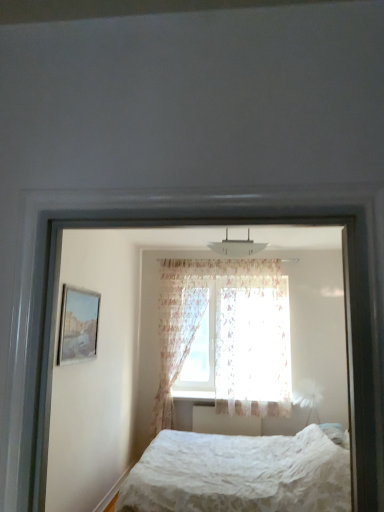
The height and width of the screenshot is (512, 384). What do you see at coordinates (253, 346) in the screenshot? I see `translucent floral fabric at center, positioned as the first curtain in right-to-left order` at bounding box center [253, 346].

The image size is (384, 512). Find the location of `translucent floral fabric at center, positioned as the first curtain in right-to-left order`. translucent floral fabric at center, positioned as the first curtain in right-to-left order is located at coordinates (253, 346).

The image size is (384, 512). Describe the element at coordinates (223, 423) in the screenshot. I see `white plastic radiator at center` at that location.

Measure the distance between floral fabric curtain at center, arranged as the 2th curtain when viewed from the right, and camera.

The depth of floral fabric curtain at center, arranged as the 2th curtain when viewed from the right, is 17.22 feet.

Identify the location of matte glass picture frame at left. (78, 325).

I want to click on white textured bed at center, acting as the second bed starting from the bottom, so click(x=239, y=474).

Which is less distant, (292, 436) or (165, 418)?

Point (292, 436).

From the image's perspective, is white lace bed at lower center, the second bed from the front, above or below floral fabric curtain at center, arranged as the 2th curtain when viewed from the right?

Based on their image positions, white lace bed at lower center, the second bed from the front, is located beneath floral fabric curtain at center, arranged as the 2th curtain when viewed from the right.

Would you say white lace bed at lower center, the second bed from the front, is a long distance from floral fabric curtain at center, arranged as the 2th curtain when viewed from the right?

Yes, white lace bed at lower center, the second bed from the front, and floral fabric curtain at center, arranged as the 2th curtain when viewed from the right, are located far from each other.

Is white lace bed at lower center, which appears as the 1th bed when viewed from the back, positioned with its back to floral fabric curtain at center, arranged as the 2th curtain when viewed from the right?

No, floral fabric curtain at center, arranged as the 2th curtain when viewed from the right, is not at the back of white lace bed at lower center, which appears as the 1th bed when viewed from the back.

In the scene shown: From the image's perspective, is floral fabric curtain at center, the first curtain when ordered from left to right, on white textured bed at center, which is the 1th bed from top to bottom?

Actually, floral fabric curtain at center, the first curtain when ordered from left to right, appears below white textured bed at center, which is the 1th bed from top to bottom, in the image.

Can you confirm if floral fabric curtain at center, the first curtain when ordered from left to right, is thinner than white textured bed at center, marked as the 2th bed in a back-to-front arrangement?

No, floral fabric curtain at center, the first curtain when ordered from left to right, is not thinner than white textured bed at center, marked as the 2th bed in a back-to-front arrangement.

Is there a large distance between floral fabric curtain at center, arranged as the 2th curtain when viewed from the right, and white textured bed at center, marked as the 2th bed in a back-to-front arrangement?

Yes, floral fabric curtain at center, arranged as the 2th curtain when viewed from the right, and white textured bed at center, marked as the 2th bed in a back-to-front arrangement, are located far from each other.

Is floral fabric curtain at center, arranged as the 2th curtain when viewed from the right, bigger than white textured bed at center, which is the 1th bed from top to bottom?

Yes, floral fabric curtain at center, arranged as the 2th curtain when viewed from the right, is bigger than white textured bed at center, which is the 1th bed from top to bottom.

Where is `bed that is the 2nd object located in front of the translucent floral fabric at center, the second curtain when ordered from left to right`? bed that is the 2nd object located in front of the translucent floral fabric at center, the second curtain when ordered from left to right is located at coordinates (239, 474).

Is translucent floral fabric at center, the second curtain when ordered from left to right, not within white textured bed at center, which is the 1th bed from top to bottom?

That's correct, translucent floral fabric at center, the second curtain when ordered from left to right, is outside of white textured bed at center, which is the 1th bed from top to bottom.

From the image's perspective, would you say translucent floral fabric at center, the second curtain when ordered from left to right, is positioned over white textured bed at center, which is the 1th bed from front to back?

No.

Is white textured bed at center, which is the 1th bed from front to back, at the back of translucent floral fabric at center, positioned as the first curtain in right-to-left order?

translucent floral fabric at center, positioned as the first curtain in right-to-left order, does not have its back to white textured bed at center, which is the 1th bed from front to back.

From a real-world perspective, which object rests below the other?

white lace bed at lower center, which appears as the 1th bed when viewed from the back, from a real-world perspective.

In the scene shown: Is white textured bed at center, which is the 1th bed from front to back, at the back of white lace bed at lower center, which is counted as the 1th bed, starting from the bottom?

That's not correct — white lace bed at lower center, which is counted as the 1th bed, starting from the bottom, is not looking away from white textured bed at center, which is the 1th bed from front to back.

Considering the positions of points (247, 503) and (345, 419), is point (247, 503) farther from camera compared to point (345, 419)?

No, it is not.

Is white lace bed at lower center, which is counted as the 1th bed, starting from the bottom, bigger than white textured bed at center, which is the 1th bed from front to back?

Yes.

Is matte glass picture frame at left oriented away from translucent floral fabric at center, positioned as the first curtain in right-to-left order?

No, matte glass picture frame at left's orientation is not away from translucent floral fabric at center, positioned as the first curtain in right-to-left order.

Considering the sizes of objects matte glass picture frame at left and translucent floral fabric at center, positioned as the first curtain in right-to-left order, in the image provided, who is taller, matte glass picture frame at left or translucent floral fabric at center, positioned as the first curtain in right-to-left order,?

translucent floral fabric at center, positioned as the first curtain in right-to-left order, is taller.

Is matte glass picture frame at left inside the boundaries of translucent floral fabric at center, positioned as the first curtain in right-to-left order, or outside?

matte glass picture frame at left cannot be found inside translucent floral fabric at center, positioned as the first curtain in right-to-left order.

Looking at their sizes, would you say matte glass picture frame at left is wider or thinner than translucent floral fabric at center, the second curtain when ordered from left to right?

Clearly, matte glass picture frame at left has less width compared to translucent floral fabric at center, the second curtain when ordered from left to right.

From a real-world perspective, which is physically above, matte glass picture frame at left or white plastic radiator at center?

In real-world perspective, matte glass picture frame at left is above.

In the scene shown: From the image's perspective, is matte glass picture frame at left above or below white plastic radiator at center?

Based on their image positions, matte glass picture frame at left is located above white plastic radiator at center.

From the picture: Does matte glass picture frame at left touch white plastic radiator at center?

No, matte glass picture frame at left is not touching white plastic radiator at center.

From the picture: Considering the sizes of matte glass picture frame at left and white plastic radiator at center in the image, is matte glass picture frame at left taller or shorter than white plastic radiator at center?

In the image, matte glass picture frame at left appears to be taller than white plastic radiator at center.

What are the coordinates of `picture frame behind the white lace bed at lower center, which appears as the 1th bed when viewed from the back` in the screenshot? It's located at (78, 325).

From the image's perspective, between white lace bed at lower center, the second bed in the top-to-bottom sequence, and matte glass picture frame at left, which one is located above?

matte glass picture frame at left.

Is the depth of white lace bed at lower center, the second bed from the front, greater than that of matte glass picture frame at left?

No, it is not.

Identify the location of curtain on the left of the white lace bed at lower center, which appears as the 1th bed when viewed from the back. (178, 326).

The width and height of the screenshot is (384, 512). What are the coordinates of `bed located above the floral fabric curtain at center, the first curtain when ordered from left to right (from the image's perspective)` in the screenshot? It's located at (239, 474).

When comparing their distances from translucent floral fabric at center, the second curtain when ordered from left to right, does matte glass picture frame at left or floral fabric curtain at center, the first curtain when ordered from left to right, seem further?

matte glass picture frame at left.

Estimate the real-world distances between objects in this image. Which object is further from white plastic radiator at center, translucent floral fabric at center, positioned as the first curtain in right-to-left order, or matte glass picture frame at left?

matte glass picture frame at left lies further to white plastic radiator at center than the other object.

Estimate the real-world distances between objects in this image. Which object is further from floral fabric curtain at center, the first curtain when ordered from left to right, white plastic radiator at center or white textured bed at center, which is the 1th bed from front to back?

white textured bed at center, which is the 1th bed from front to back, lies further to floral fabric curtain at center, the first curtain when ordered from left to right, than the other object.

Looking at this image, considering their positions, is matte glass picture frame at left positioned closer to white lace bed at lower center, which appears as the 1th bed when viewed from the back, than white textured bed at center, marked as the 2th bed in a back-to-front arrangement?

white textured bed at center, marked as the 2th bed in a back-to-front arrangement, is positioned closer to the anchor white lace bed at lower center, which appears as the 1th bed when viewed from the back.

Estimate the real-world distances between objects in this image. Which object is further from white textured bed at center, acting as the second bed starting from the bottom, white lace bed at lower center, the second bed from the front, or matte glass picture frame at left?

Among the two, matte glass picture frame at left is located further to white textured bed at center, acting as the second bed starting from the bottom.

From the image, which object appears to be nearer to matte glass picture frame at left, white lace bed at lower center, the second bed in the top-to-bottom sequence, or translucent floral fabric at center, the second curtain when ordered from left to right?

white lace bed at lower center, the second bed in the top-to-bottom sequence, lies closer to matte glass picture frame at left than the other object.

Based on their spatial positions, is white textured bed at center, acting as the second bed starting from the bottom, or white plastic radiator at center closer to translucent floral fabric at center, the second curtain when ordered from left to right?

white textured bed at center, acting as the second bed starting from the bottom, is closer to translucent floral fabric at center, the second curtain when ordered from left to right.

Considering their positions, is white plastic radiator at center positioned further to translucent floral fabric at center, positioned as the first curtain in right-to-left order, than floral fabric curtain at center, arranged as the 2th curtain when viewed from the right?

Among the two, white plastic radiator at center is located further to translucent floral fabric at center, positioned as the first curtain in right-to-left order.

Where is `picture frame positioned between white textured bed at center, acting as the second bed starting from the bottom, and translucent floral fabric at center, the second curtain when ordered from left to right, from near to far`? Image resolution: width=384 pixels, height=512 pixels. picture frame positioned between white textured bed at center, acting as the second bed starting from the bottom, and translucent floral fabric at center, the second curtain when ordered from left to right, from near to far is located at coordinates (78, 325).

Locate an element on the screen. picture frame between white textured bed at center, which is the 1th bed from front to back, and white plastic radiator at center in the front-back direction is located at coordinates (78, 325).

Locate an element on the screen. Image resolution: width=384 pixels, height=512 pixels. bed between white textured bed at center, which is the 1th bed from front to back, and translucent floral fabric at center, the second curtain when ordered from left to right, in the front-back direction is located at coordinates (239, 474).

I want to click on curtain located between white lace bed at lower center, the second bed in the top-to-bottom sequence, and floral fabric curtain at center, arranged as the 2th curtain when viewed from the right, in the depth direction, so click(x=253, y=346).